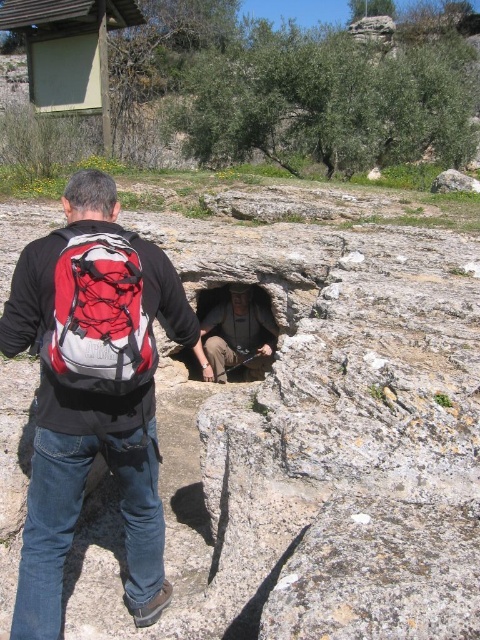
Is red backpack at center taller than rough stone hole at center?

Correct, red backpack at center is much taller as rough stone hole at center.

Is red backpack at center below rough stone hole at center?

Yes, red backpack at center is below rough stone hole at center.

Find the location of a particular element. The height and width of the screenshot is (640, 480). red backpack at center is located at coordinates (108, 465).

Which of these two, red mesh backpack at center or rough stone hole at center, stands taller?

With more height is rough stone hole at center.

Who is positioned more to the left, red mesh backpack at center or rough stone hole at center?

red mesh backpack at center is more to the left.

Does point (92, 392) come farther from viewer compared to point (203, 372)?

No, (92, 392) is closer to viewer.

The image size is (480, 640). In order to click on red mesh backpack at center in this screenshot , I will do point(98,316).

Which is above, red backpack at center or red mesh backpack at center?

red mesh backpack at center is above.

What are the coordinates of `red backpack at center` in the screenshot? It's located at (108, 465).

At what (x,y) coordinates should I click in order to perform the action: click on red backpack at center. Please return your answer as a coordinate pair (x, y). The width and height of the screenshot is (480, 640). Looking at the image, I should click on (108, 465).